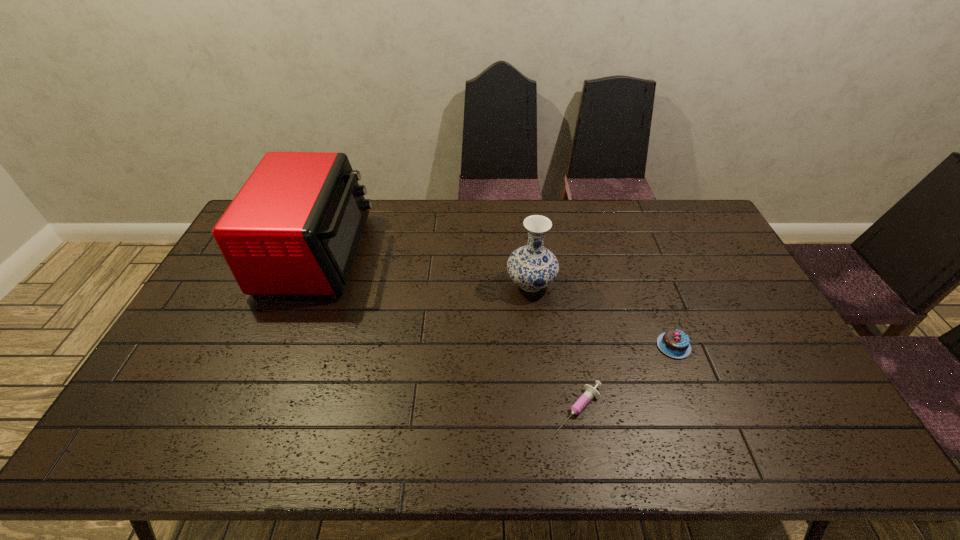
Locate an element on the screen. Image resolution: width=960 pixels, height=540 pixels. free space that satisfies the following two spatial constraints: 1. on the front-facing side of the chocolate cake; 2. on the right side of the toaster oven is located at coordinates (281, 346).

Image resolution: width=960 pixels, height=540 pixels. I want to click on vacant region that satisfies the following two spatial constraints: 1. on the front-facing side of the leftmost object; 2. on the back side of the vase, so click(x=306, y=284).